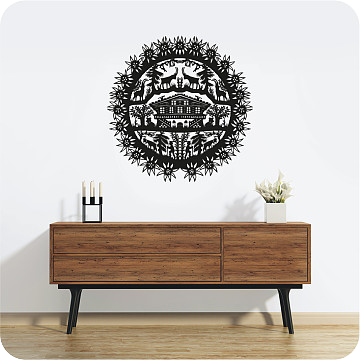
Where is `stand`? stand is located at coordinates (70, 312).